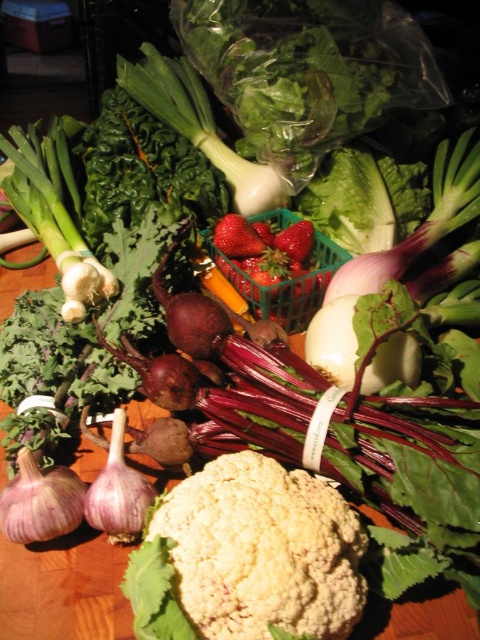
Question: Observing the image, what is the correct spatial positioning of green plastic basket at center in reference to red matte strawberries at center?

Choices:
 (A) above
 (B) below

Answer: (B)

Question: Which object is the closest to the purple matte garlic at center?

Choices:
 (A) purple matte garlic at lower left
 (B) red matte strawberries at center
 (C) white matte cauliflower at center

Answer: (A)

Question: Can you confirm if purple matte garlic at center is positioned below red matte strawberries at center?

Choices:
 (A) yes
 (B) no

Answer: (A)

Question: Can you confirm if red matte strawberries at center is thinner than purple matte garlic at lower left?

Choices:
 (A) yes
 (B) no

Answer: (B)

Question: Which of the following is the farthest from the observer?

Choices:
 (A) red matte strawberries at center
 (B) white matte cauliflower at center
 (C) green plastic basket at center

Answer: (A)

Question: Which point appears farthest from the camera in this image?

Choices:
 (A) (264, 234)
 (B) (301, 280)

Answer: (A)